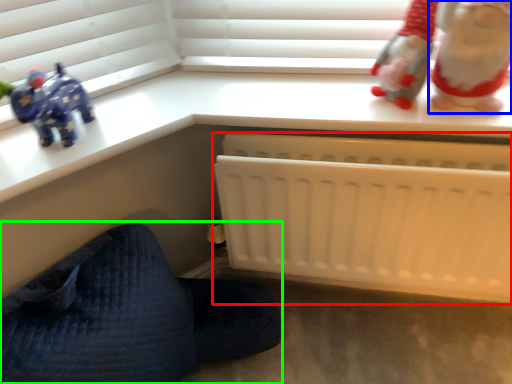
Question: Which is nearer to the infant bed (highlighted by a red box)? toy (highlighted by a blue box) or furniture (highlighted by a green box).

Choices:
 (A) toy
 (B) furniture

Answer: (A)